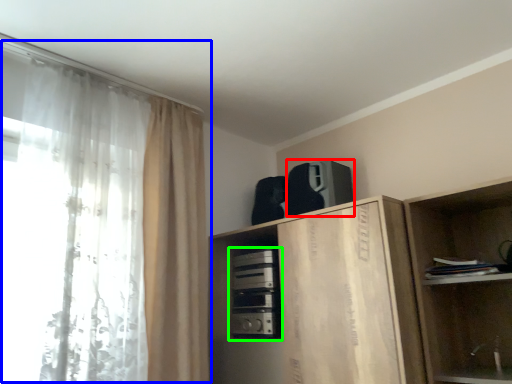
Question: Which object is the farthest from appliance (highlighted by a red box)? Choose among these: curtain (highlighted by a blue box) or appliance (highlighted by a green box).

Choices:
 (A) curtain
 (B) appliance

Answer: (A)